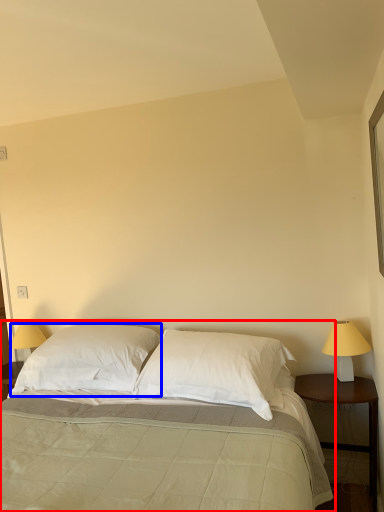
Question: Which object is closer to the camera taking this photo, bed (highlighted by a red box) or pillow (highlighted by a blue box)?

Choices:
 (A) bed
 (B) pillow

Answer: (A)